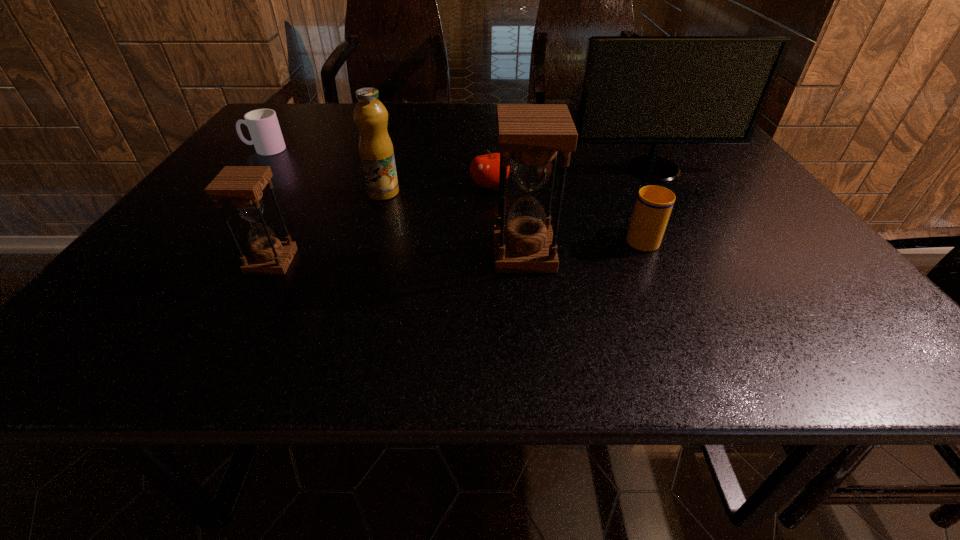
Locate an element on the screen. free space located on the right of the shorter hourglass is located at coordinates (339, 261).

This screenshot has height=540, width=960. What are the coordinates of `free space located on the right of the taller hourglass` in the screenshot? It's located at pyautogui.click(x=744, y=254).

Find the location of a particular element. Image resolution: width=960 pixels, height=540 pixels. blank space located on the back of the apple is located at coordinates (489, 150).

In order to click on vacant region located 0.180m on the front label of the fifth shortest object in this screenshot , I will do `click(476, 193)`.

At what (x,y) coordinates should I click in order to perform the action: click on free location located 0.220m on the front-facing side of the computer monitor. Please return your answer as a coordinate pair (x, y). The image size is (960, 540). Looking at the image, I should click on (694, 238).

In order to click on blank space located on the side of the right cup with the handle in this screenshot , I will do `click(602, 151)`.

Identify the location of free space located on the side of the right cup with the handle. This screenshot has width=960, height=540. (608, 164).

Where is `blank space located on the side of the right cup with the handle`? blank space located on the side of the right cup with the handle is located at coordinates (620, 192).

Identify the location of object that is at the left edge. (263, 125).

I want to click on object that is at the right edge, so click(x=655, y=90).